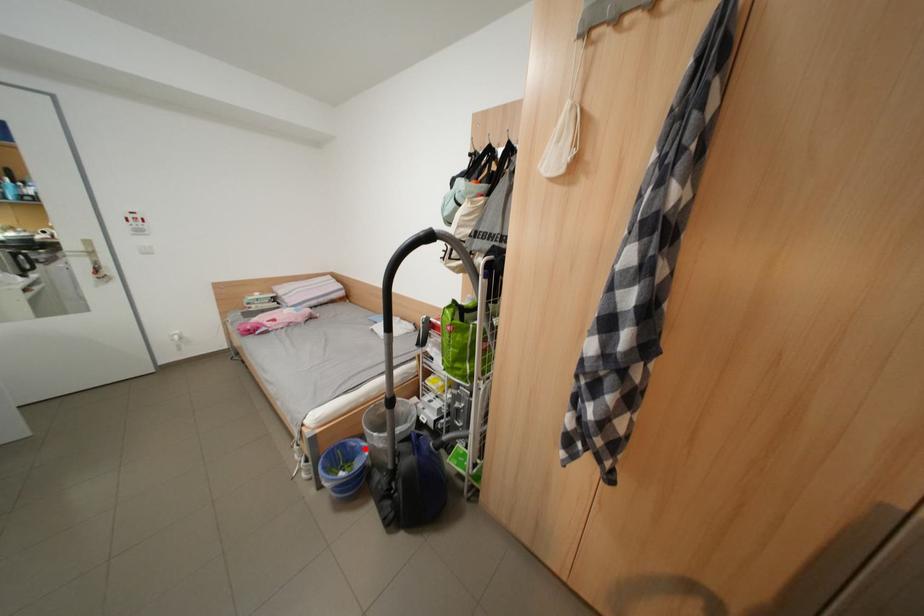
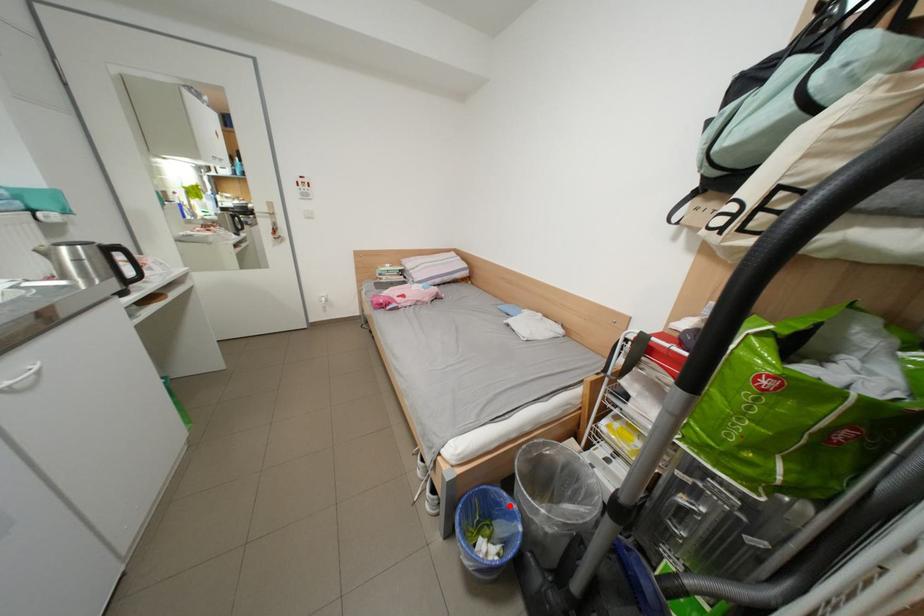
I am providing you with two images of the same scene from different viewpoints. A red point is marked on the first image and another point is marked on the second image. Is the red point in image1 aligned with the point shown in image2?

Yes